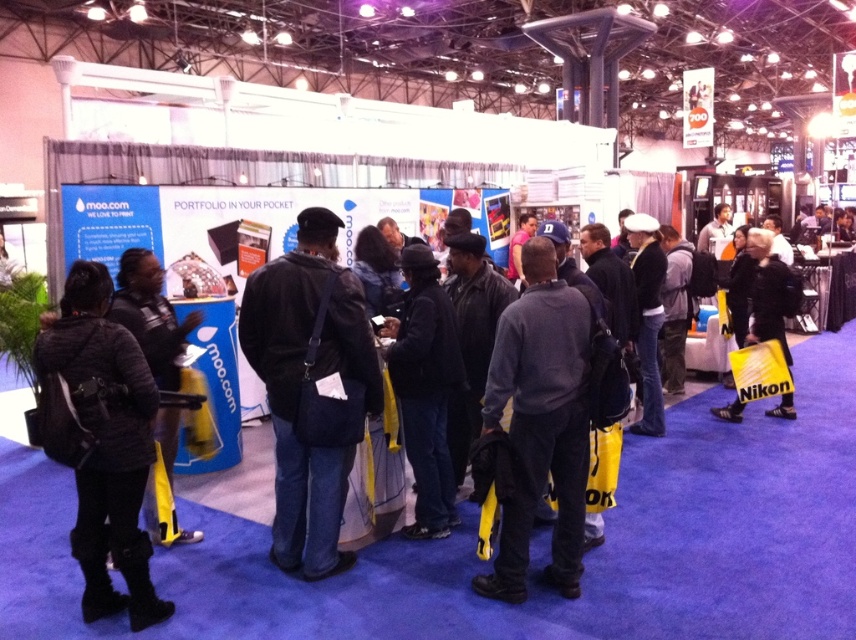
I want to click on dark gray sweater at center, so click(x=539, y=422).

Is dark gray sweater at center positioned at the back of black leather jacket at right?

No, it is not.

The width and height of the screenshot is (856, 640). What do you see at coordinates (539, 422) in the screenshot?
I see `dark gray sweater at center` at bounding box center [539, 422].

This screenshot has height=640, width=856. I want to click on dark gray sweater at center, so click(539, 422).

Between dark gray sweater at center and black leather jacket at left, which one is positioned higher?

black leather jacket at left

Which is behind, point (490, 381) or point (117, 301)?

Point (117, 301)

Which is behind, point (521, 352) or point (164, 426)?

The point (164, 426) is more distant.

Where is `dark gray sweater at center`? The width and height of the screenshot is (856, 640). dark gray sweater at center is located at coordinates (539, 422).

Measure the distance between point (342, 305) and camera.

A distance of 3.25 meters exists between point (342, 305) and camera.

Which is behind, point (330, 550) or point (504, 548)?

The point (330, 550) is behind.

Locate an element on the screen. This screenshot has width=856, height=640. dark blue leather jacket at center is located at coordinates (310, 387).